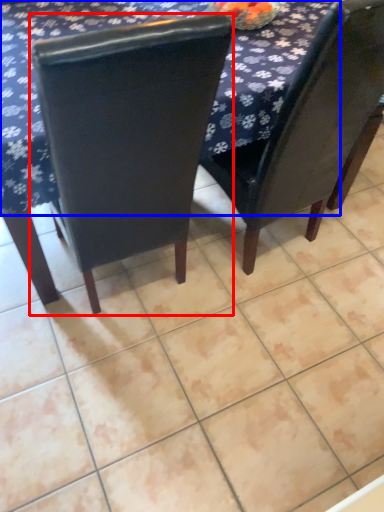
Question: Which object is further to the camera taking this photo, chair (highlighted by a red box) or tablecloth (highlighted by a blue box)?

Choices:
 (A) chair
 (B) tablecloth

Answer: (B)